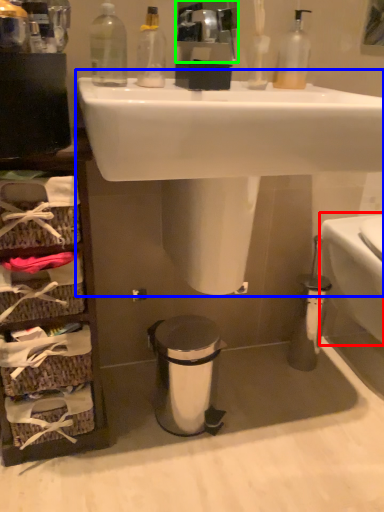
Question: Considering the real-world distances, which object is farthest from toilet bowl (highlighted by a red box)? sink (highlighted by a blue box) or mirror (highlighted by a green box)?

Choices:
 (A) sink
 (B) mirror

Answer: (B)